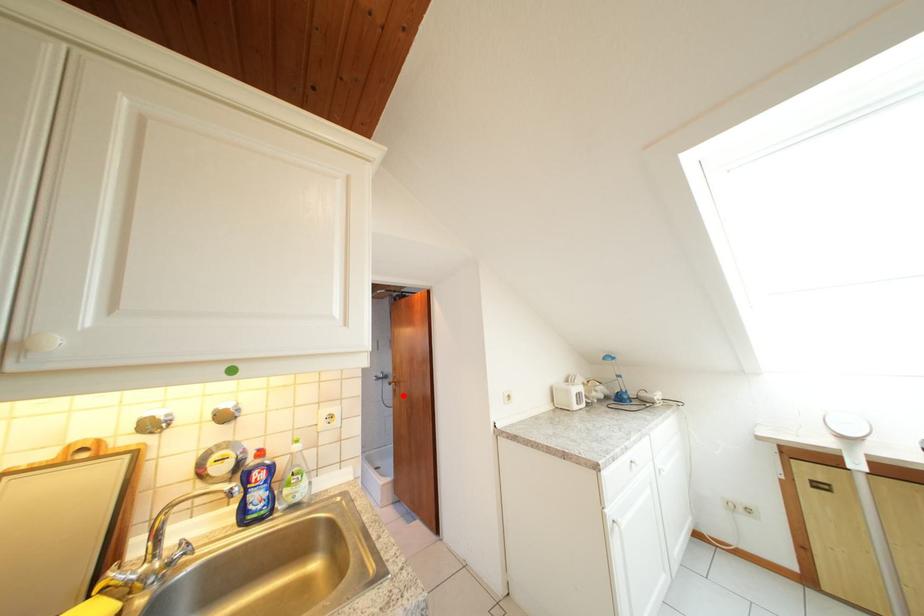
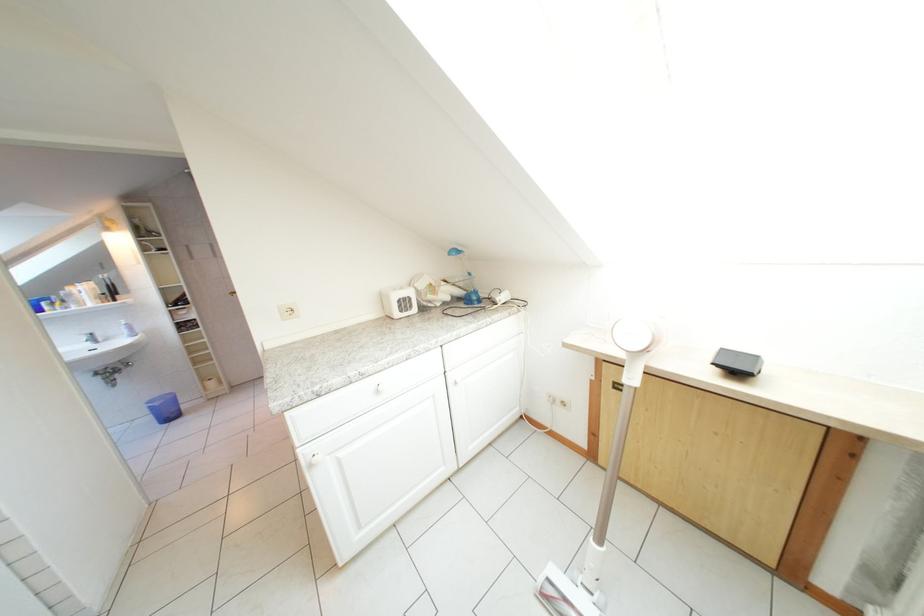
Question: I am providing you with two images of the same scene from different viewpoints. A red point is marked on the first image. Is the red point's position out of view in image 2?

Choices:
 (A) Yes
 (B) No

Answer: (A)